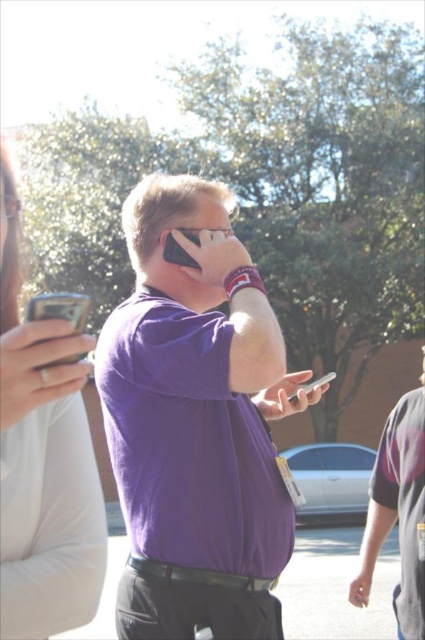
You are a photographer trying to capture both the matte black smartphone at lower left and the silver metallic phone at center in a single frame. Which phone should you focus on to ensure both are fully visible without zooming?

The matte black smartphone at lower left is wider than the silver metallic phone at center, so focusing on the wider matte black smartphone at lower left would allow both devices to fit within the frame without zooming.

You are a photographer trying to capture a closeup of the silver metallic phone at center without including the matte black smartphone at lower left in the frame. Based on their positions, is this possible?

The matte black smartphone at lower left is to the left of the silver metallic phone at center, so if you position the camera to the right side of the silver metallic phone at center, you can avoid including the matte black smartphone at lower left in the frame.

What is the color and type of the object located at point (x=44, y=461) in the image?

The object at point (x=44, y=461) is a matte black phone.